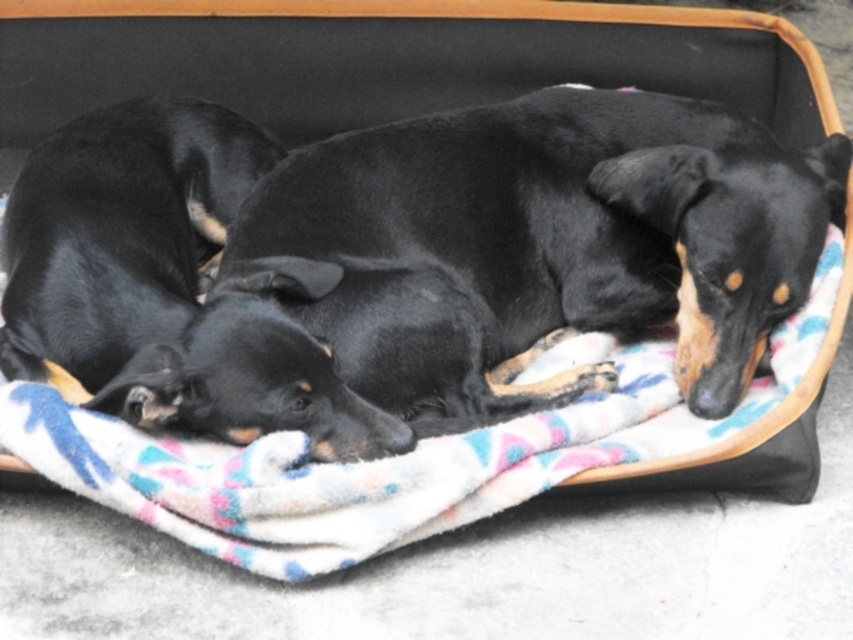
Which is more to the left, fuzzy multicolored blanket at center or black smooth dog at left?

black smooth dog at left

In the scene shown: Who is more distant from viewer, [215,531] or [209,164]?

Point [209,164]

At what (x,y) coordinates should I click in order to perform the action: click on fuzzy multicolored blanket at center. Please return your answer as a coordinate pair (x, y). Image resolution: width=853 pixels, height=640 pixels. Looking at the image, I should click on (390, 458).

Where is `fuzzy multicolored blanket at center`? Image resolution: width=853 pixels, height=640 pixels. fuzzy multicolored blanket at center is located at coordinates (390, 458).

Is point (508, 205) positioned after point (119, 237)?

That is True.

Is black smooth dog at center shorter than black smooth dog at left?

In fact, black smooth dog at center may be taller than black smooth dog at left.

I want to click on black smooth dog at center, so click(534, 246).

Does black smooth dog at center have a greater width compared to fuzzy multicolored blanket at center?

No.

Is point (476, 257) farther from camera compared to point (317, 556)?

Yes, point (476, 257) is farther from viewer.

Where is `black smooth dog at center`? black smooth dog at center is located at coordinates (534, 246).